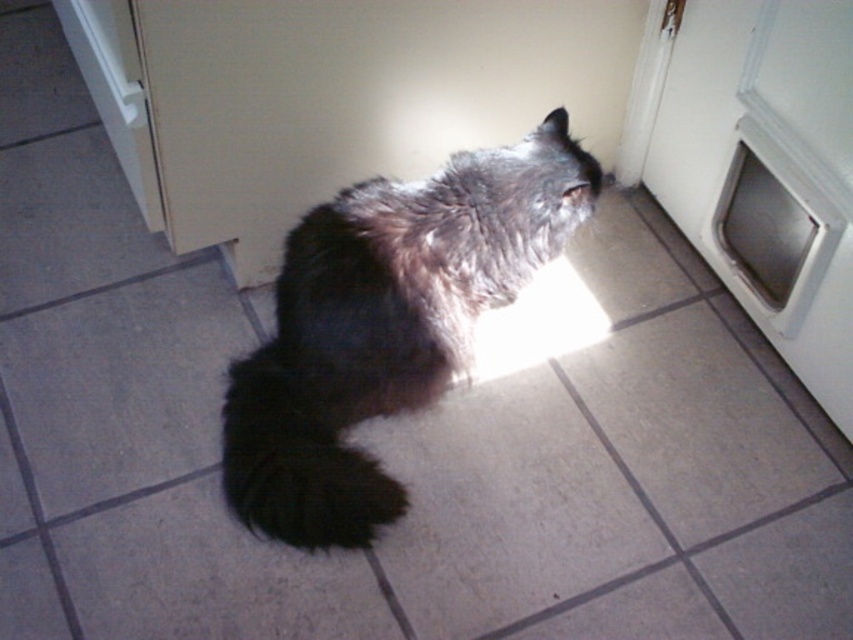
Is dark fur cat at center taller than black fluffy tail at lower center?

Yes.

Between point (305, 323) and point (357, 547), which one is positioned in front?

Point (357, 547)

At what (x,y) coordinates should I click in order to perform the action: click on dark fur cat at center. Please return your answer as a coordinate pair (x, y). The image size is (853, 640). Looking at the image, I should click on (386, 324).

Does black fluffy tail at lower center appear on the right side of white plastic pet door at center right?

In fact, black fluffy tail at lower center is to the left of white plastic pet door at center right.

Does point (328, 442) come farther from viewer compared to point (817, 257)?

Yes, it is.

In order to click on black fluffy tail at lower center in this screenshot , I will do `click(297, 461)`.

Where is `black fluffy tail at lower center`? Image resolution: width=853 pixels, height=640 pixels. black fluffy tail at lower center is located at coordinates (297, 461).

Is the position of dark fur cat at center less distant than that of white plastic pet door at center right?

No, dark fur cat at center is behind white plastic pet door at center right.

Can you confirm if dark fur cat at center is wider than white plastic pet door at center right?

Yes, dark fur cat at center is wider than white plastic pet door at center right.

Locate an element on the screen. This screenshot has height=640, width=853. dark fur cat at center is located at coordinates (386, 324).

This screenshot has width=853, height=640. Identify the location of dark fur cat at center. (386, 324).